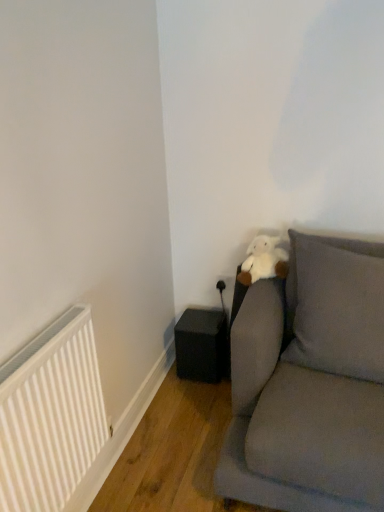
Question: Is black matte speaker at lower left further to camera compared to velvet gray couch at right?

Choices:
 (A) no
 (B) yes

Answer: (B)

Question: Is velvet gray couch at right at the back of black matte speaker at lower left?

Choices:
 (A) yes
 (B) no

Answer: (B)

Question: Is black matte speaker at lower left to the left of velvet gray couch at right from the viewer's perspective?

Choices:
 (A) yes
 (B) no

Answer: (A)

Question: Is black matte speaker at lower left not inside velvet gray couch at right?

Choices:
 (A) yes
 (B) no

Answer: (A)

Question: From the image's perspective, does black matte speaker at lower left appear lower than velvet gray couch at right?

Choices:
 (A) no
 (B) yes

Answer: (B)

Question: From a real-world perspective, is white matte radiator at lower left positioned above or below velvet gray couch at right?

Choices:
 (A) below
 (B) above

Answer: (B)

Question: Is white matte radiator at lower left inside the boundaries of velvet gray couch at right, or outside?

Choices:
 (A) inside
 (B) outside

Answer: (B)

Question: From their relative heights in the image, would you say white matte radiator at lower left is taller or shorter than velvet gray couch at right?

Choices:
 (A) short
 (B) tall

Answer: (A)

Question: From the image's perspective, is white matte radiator at lower left located above or below velvet gray couch at right?

Choices:
 (A) above
 (B) below

Answer: (B)

Question: Considering the positions of white plush at upper right and black matte speaker at lower left in the image, is white plush at upper right bigger or smaller than black matte speaker at lower left?

Choices:
 (A) small
 (B) big

Answer: (A)

Question: Considering the positions of white plush at upper right and black matte speaker at lower left in the image, is white plush at upper right wider or thinner than black matte speaker at lower left?

Choices:
 (A) wide
 (B) thin

Answer: (B)

Question: From a real-world perspective, is white plush at upper right physically located above or below black matte speaker at lower left?

Choices:
 (A) below
 (B) above

Answer: (B)

Question: Is white plush at upper right situated inside black matte speaker at lower left or outside?

Choices:
 (A) outside
 (B) inside

Answer: (A)

Question: From their relative heights in the image, would you say velvet gray couch at right is taller or shorter than white matte radiator at lower left?

Choices:
 (A) short
 (B) tall

Answer: (B)

Question: Looking at their shapes, would you say velvet gray couch at right is wider or thinner than white matte radiator at lower left?

Choices:
 (A) wide
 (B) thin

Answer: (A)